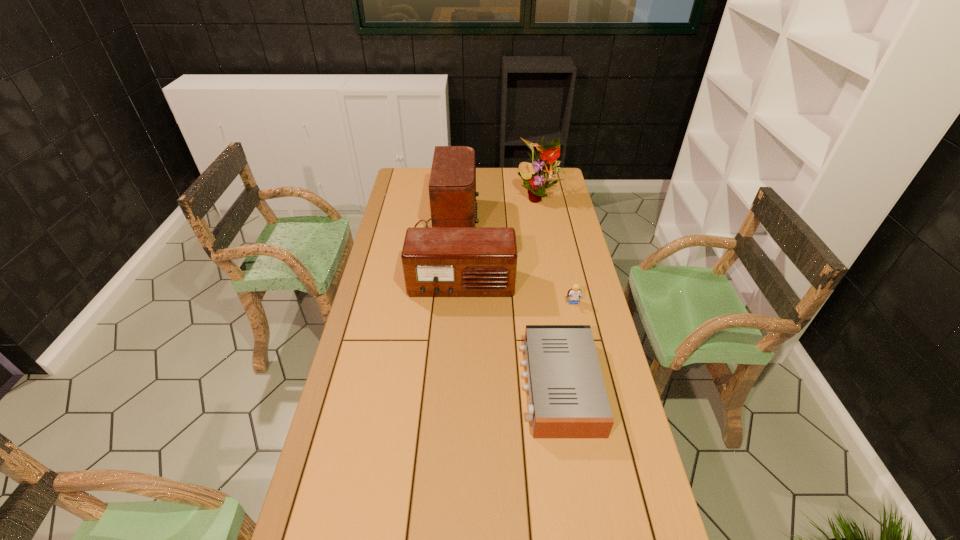
Image resolution: width=960 pixels, height=540 pixels. I want to click on bouquet, so click(540, 172).

Locate an element on the screen. The width and height of the screenshot is (960, 540). the tallest radio receiver is located at coordinates (452, 186).

The image size is (960, 540). I want to click on the second farthest radio receiver, so click(437, 262).

The width and height of the screenshot is (960, 540). What are the coordinates of `the second shortest radio receiver` in the screenshot? It's located at (437, 262).

Where is `Lego`? Image resolution: width=960 pixels, height=540 pixels. Lego is located at coordinates (574, 293).

Where is `the shortest radio receiver`? This screenshot has height=540, width=960. the shortest radio receiver is located at coordinates (568, 399).

Where is `the nearest object`? The width and height of the screenshot is (960, 540). the nearest object is located at coordinates (568, 399).

Identify the location of vacant position located 0.280m on the front-facing side of the bouquet. Image resolution: width=960 pixels, height=540 pixels. (547, 246).

This screenshot has width=960, height=540. I want to click on free location located 0.240m on the front panel of the farthest radio receiver, so click(x=531, y=219).

Locate an element on the screen. Image resolution: width=960 pixels, height=540 pixels. vacant position located 0.160m on the front-facing side of the second shortest radio receiver is located at coordinates (459, 335).